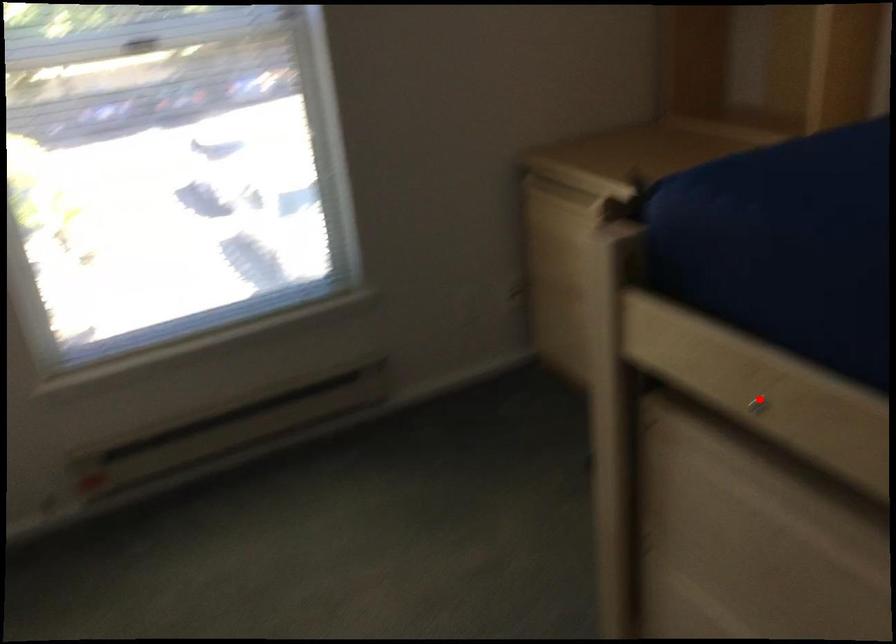
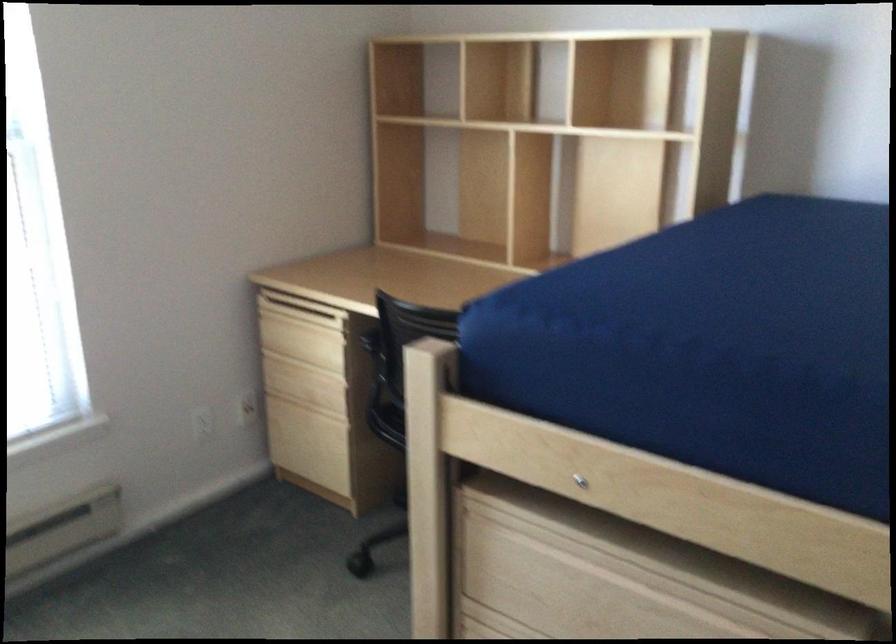
The point at the highlighted location is marked in the first image. Where is the corresponding point in the second image?

(579, 480)